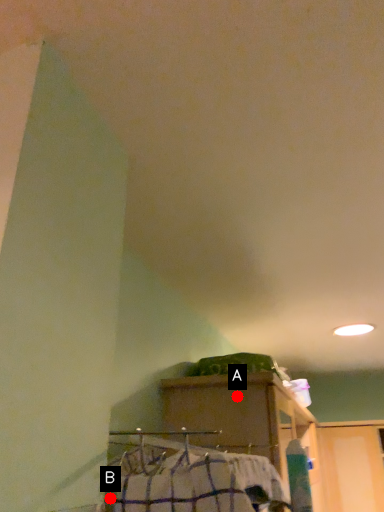
Question: Two points are circled on the image, labeled by A and B beside each circle. Which of the following is the farthest from the observer?

Choices:
 (A) A is further
 (B) B is further

Answer: (A)